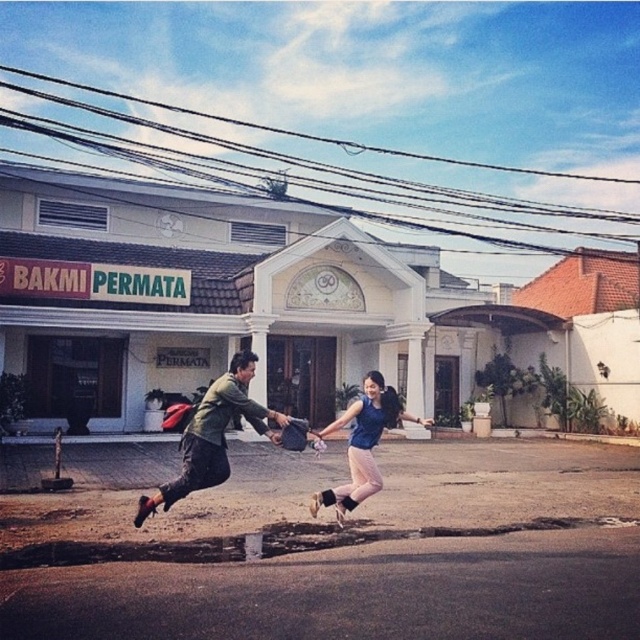
You are standing at the entrance of BAKMI PERMATA and want to walk to the blue fabric dress at center without stepping on the brown asphalt puddle at lower center. Given that the puddle is 8.62 feet away from the dress, can you safely walk around it?

The brown asphalt puddle at lower center is 8.62 feet away from the blue fabric dress at center. Since the distance is sufficient, you can safely walk around the puddle to reach the dress without stepping on it.

You are a delivery person approaching the BAKMI PERMATA building. You see a brown asphalt puddle at lower center. Can you safely walk around it if you need to reach the entrance?

The brown asphalt puddle at lower center is located at point (x=262, y=541), so it is possible to walk around it to reach the entrance as long as there is a clear path on either side.

You are standing in front of the BAKMI PERMATA building and see the brown asphalt puddle at lower center and the blue fabric dress at center. Which object is located to the left of the other?

A: The brown asphalt puddle at lower center is positioned on the left side of blue fabric dress at center.